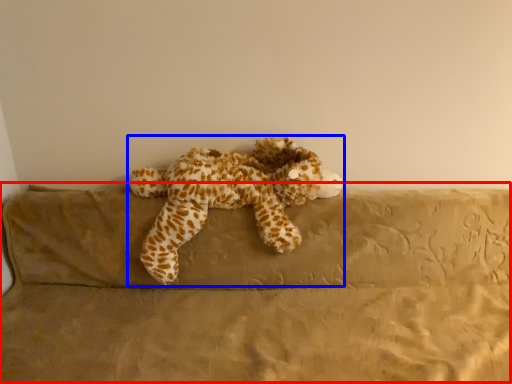
Question: Which object is further to the camera taking this photo, couch (highlighted by a red box) or toy (highlighted by a blue box)?

Choices:
 (A) couch
 (B) toy

Answer: (B)